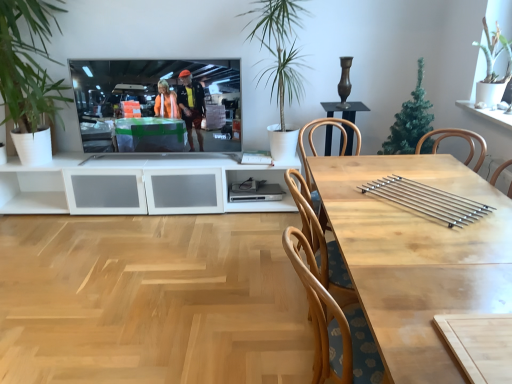
Question: Should I look upward or downward to see green leafy plant at left, which is counted as the 4th houseplant, starting from the right?

Choices:
 (A) up
 (B) down

Answer: (A)

Question: Is light wood table at center further to the viewer compared to silver metallic bars at center?

Choices:
 (A) no
 (B) yes

Answer: (A)

Question: Considering the relative sizes of light wood table at center and silver metallic bars at center in the image provided, is light wood table at center wider than silver metallic bars at center?

Choices:
 (A) no
 (B) yes

Answer: (B)

Question: Is light wood table at center positioned with its back to silver metallic bars at center?

Choices:
 (A) yes
 (B) no

Answer: (A)

Question: From the image's perspective, is light wood table at center located above silver metallic bars at center?

Choices:
 (A) yes
 (B) no

Answer: (B)

Question: Does light wood table at center have a smaller size compared to silver metallic bars at center?

Choices:
 (A) no
 (B) yes

Answer: (A)

Question: Can you confirm if light wood table at center is shorter than silver metallic bars at center?

Choices:
 (A) yes
 (B) no

Answer: (B)

Question: Can you confirm if green leafy plant at left, which is counted as the 4th houseplant, starting from the right, is smaller than green artificial tree at upper right, acting as the 2th houseplant starting from the right?

Choices:
 (A) no
 (B) yes

Answer: (A)

Question: Is green leafy plant at left, the 1th houseplant from the left, oriented towards green artificial tree at upper right, acting as the third houseplant starting from the left?

Choices:
 (A) no
 (B) yes

Answer: (A)

Question: From the image's perspective, is green leafy plant at left, the 1th houseplant from the left, on green artificial tree at upper right, acting as the 2th houseplant starting from the right?

Choices:
 (A) no
 (B) yes

Answer: (B)

Question: Is green leafy plant at left, which is counted as the 4th houseplant, starting from the right, far away from green artificial tree at upper right, acting as the 2th houseplant starting from the right?

Choices:
 (A) yes
 (B) no

Answer: (A)

Question: Is green leafy plant at left, which is counted as the 4th houseplant, starting from the right, at the right side of green artificial tree at upper right, acting as the third houseplant starting from the left?

Choices:
 (A) no
 (B) yes

Answer: (A)

Question: Is the depth of green leafy plant at left, which is counted as the 4th houseplant, starting from the right, less than that of green artificial tree at upper right, acting as the third houseplant starting from the left?

Choices:
 (A) no
 (B) yes

Answer: (B)

Question: Is green leafy plant at upper right, the first houseplant in the right-to-left sequence, located outside green artificial tree at upper right, acting as the third houseplant starting from the left?

Choices:
 (A) no
 (B) yes

Answer: (B)